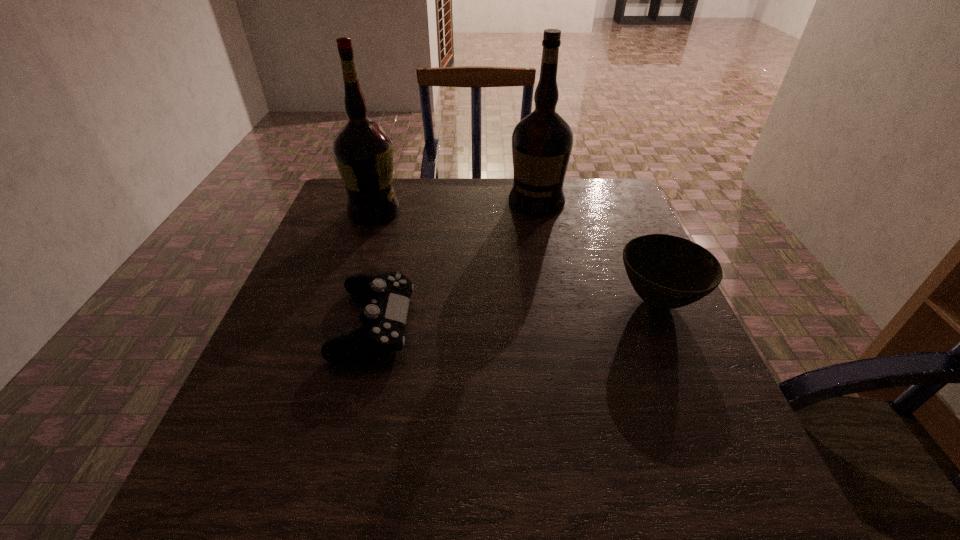
Locate an element on the screen. The height and width of the screenshot is (540, 960). vacant space positioned 0.170m on the label of the alcohol is located at coordinates (434, 246).

The image size is (960, 540). In order to click on free region located 0.170m on the label of the alcohol in this screenshot , I will do `click(434, 246)`.

The width and height of the screenshot is (960, 540). Identify the location of vacant space located 0.140m on the label of the alcohol. pos(426,241).

Where is `liquor that is positioned at the far edge`? liquor that is positioned at the far edge is located at coordinates (542, 142).

What are the coordinates of `alcohol present at the far edge` in the screenshot? It's located at (363, 152).

This screenshot has height=540, width=960. In order to click on control situated at the left edge in this screenshot , I will do `click(384, 318)`.

At what (x,y) coordinates should I click in order to perform the action: click on alcohol located at the left edge. Please return your answer as a coordinate pair (x, y). Looking at the image, I should click on (363, 152).

At what (x,y) coordinates should I click in order to perform the action: click on object present at the right edge. Please return your answer as a coordinate pair (x, y). This screenshot has width=960, height=540. Looking at the image, I should click on (667, 272).

Locate an element on the screen. object that is at the far left corner is located at coordinates (363, 152).

In the image, there is a desktop. Identify the location of vacant space at the far edge. (482, 203).